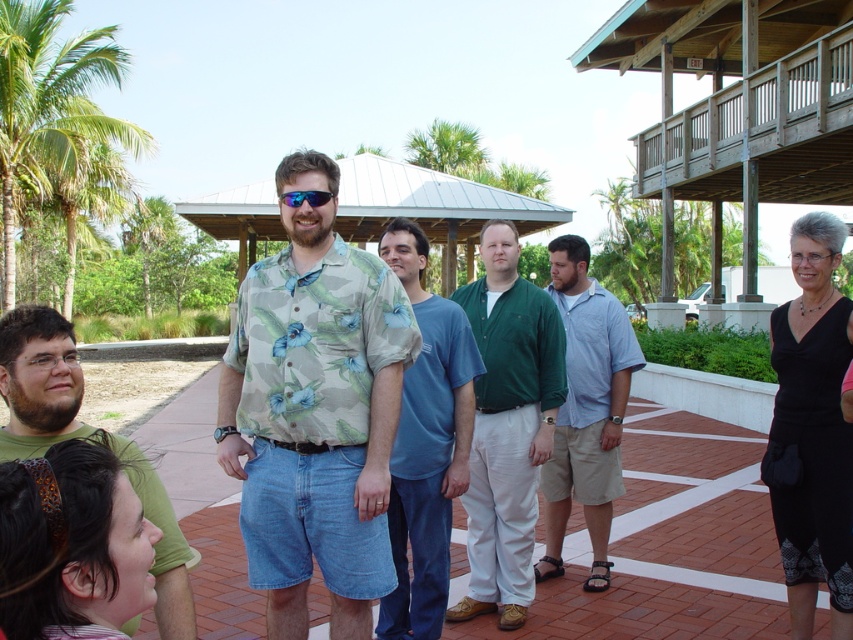
You are a photographer trying to capture a group photo of the blue cotton shirt at center and the green cotton shirt at lower left. Since you want both shirts to appear the same size in the photo, where should you position yourself relative to them?

To make the blue cotton shirt at center and the green cotton shirt at lower left appear the same size in the photo, you should move closer to the green cotton shirt at lower left because it is larger than the blue cotton shirt at center.

You are organizing a photoshoot and need to know the relative positions of the black matte dress at lower right and the light blue cotton shirt at center. Which one is located to the right of the other?

The black matte dress at lower right is positioned on the right side of light blue cotton shirt at center.

You are organizing a photo shoot and need to ensure that the green cotton shirt at center and the green leafy palm tree at upper left are both visible in the frame. Based on their sizes, which object should you focus on to ensure both are captured adequately?

The green cotton shirt at center occupies less space than the green leafy palm tree at upper left, so you should focus on the green leafy palm tree at upper left to ensure both are visible since it is larger and requires more attention in framing.